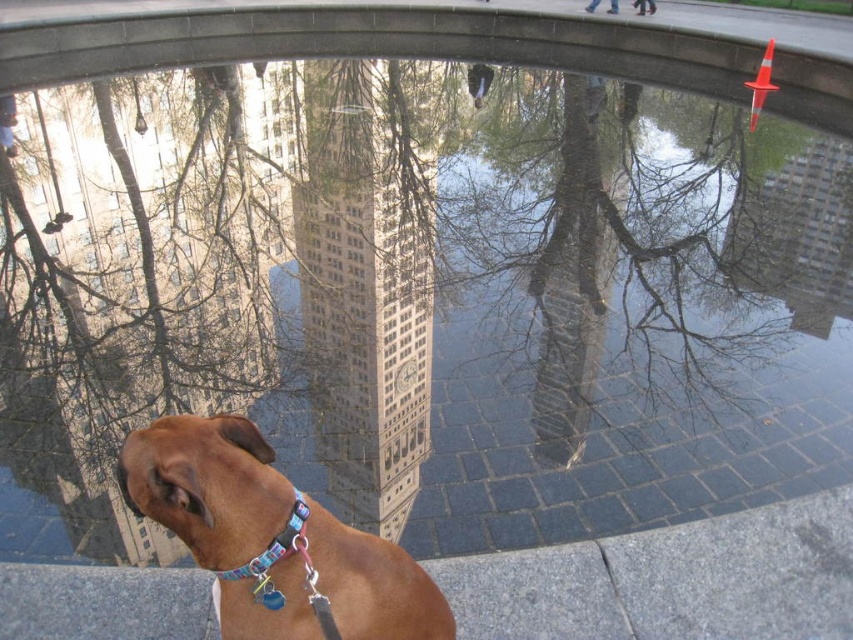
Which of these two, brown matte dog at center or multicolored fabric neckband at lower center, stands shorter?

Standing shorter between the two is multicolored fabric neckband at lower center.

Which is behind, point (252, 608) or point (225, 572)?

The point (252, 608) is more distant.

Where is `brown matte dog at center`? The height and width of the screenshot is (640, 853). brown matte dog at center is located at coordinates coord(271,538).

Is smooth glass water at center smaller than brown matte dog at center?

No.

The width and height of the screenshot is (853, 640). What are the coordinates of `smooth glass water at center` in the screenshot? It's located at (589, 243).

Describe the element at coordinates (589, 243) in the screenshot. I see `smooth glass water at center` at that location.

Who is shorter, smooth glass water at center or multicolored fabric neckband at lower center?

multicolored fabric neckband at lower center

Does point (614, 264) come behind point (299, 506)?

Yes, it is behind point (299, 506).

Locate an element on the screen. smooth glass water at center is located at coordinates (589, 243).